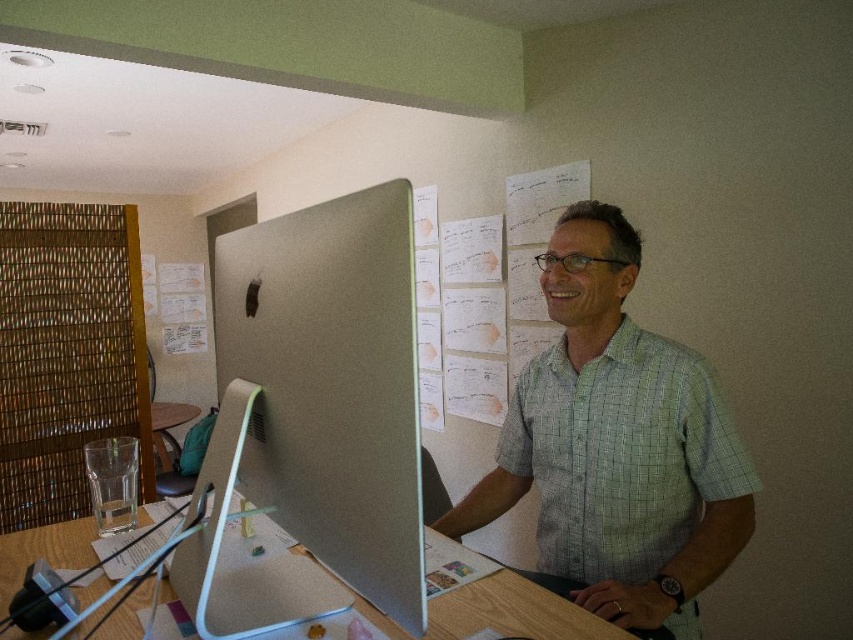
You are a delivery robot trying to place a package on the wooden desk at center. The delivery area must be free of items. Is the point at coordinates point (512, 612) on the wooden desk at center clear of any objects?

The point (512, 612) is on wooden desk at center, but there are items like a transparent glass cup, papers, and a small figurine or decorative item near the base of the monitor. Since the point is on the desk, it may be occupied by one of these items. Without knowing the exact location of each item relative to the point, it is uncertain if the point is clear.

You are a fashion designer observing the workspace scene. You need to determine which object is bigger between the green checkered shirt at center and the woven bamboo at left. Can you help?

The green checkered shirt at center is larger in size than the woven bamboo at left.

You are organizing a small event and need to place a 1.2 meter long banner on the desk. Which desk should you choose between the wooden desk at center and the brown wooden table at center to ensure the banner fits horizontally?

The wooden desk at center is wider than the brown wooden table at center, so the banner will fit better on the wooden desk at center.